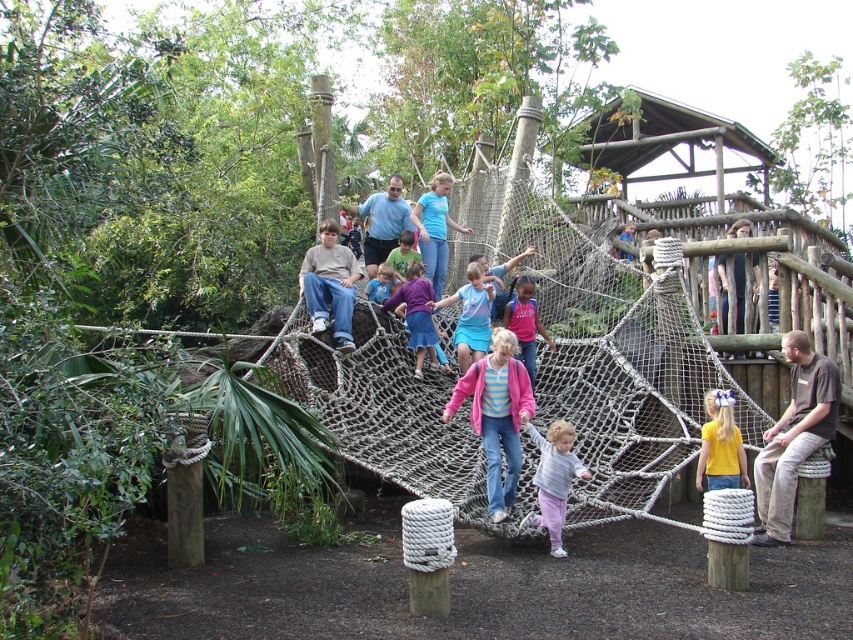
Consider the image. Who is higher up, matte blue jeans at center or pink fabric at center?

matte blue jeans at center is higher up.

Between point (320, 320) and point (521, 330), which one is positioned in front?

Point (320, 320)

Between point (334, 221) and point (521, 296), which one is positioned in front?

Point (521, 296)

Where is `matte blue jeans at center`? This screenshot has width=853, height=640. matte blue jeans at center is located at coordinates (329, 284).

Image resolution: width=853 pixels, height=640 pixels. In order to click on pink fleece jacket at center in this screenshot , I will do `click(496, 416)`.

The height and width of the screenshot is (640, 853). What are the coordinates of `pink fleece jacket at center` in the screenshot? It's located at (496, 416).

Who is lower down, rope net at center or blue denim jeans at center?

rope net at center is below.

Describe the element at coordinates (619, 372) in the screenshot. I see `rope net at center` at that location.

Which is behind, point (679, 317) or point (428, 182)?

Positioned behind is point (428, 182).

Where is `rope net at center`? Image resolution: width=853 pixels, height=640 pixels. rope net at center is located at coordinates (619, 372).